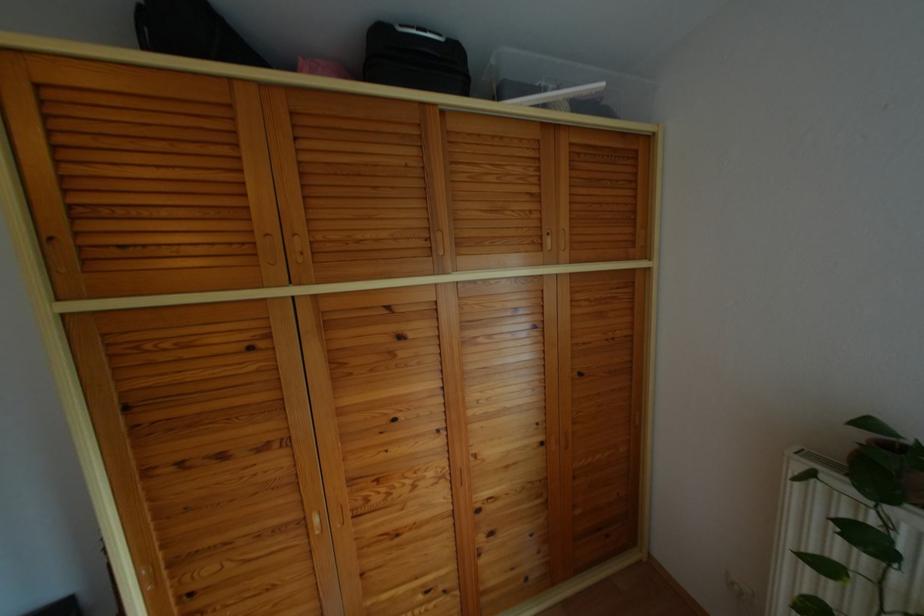
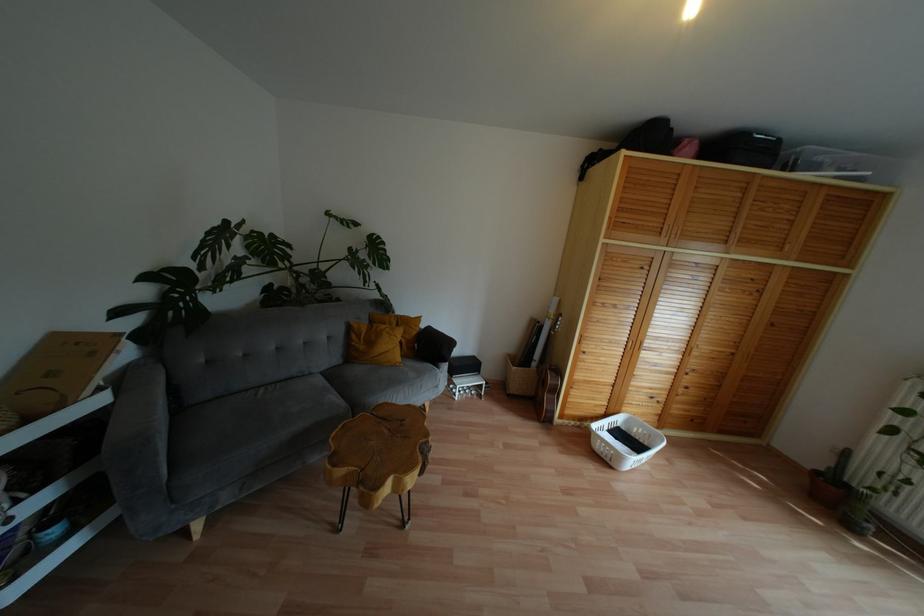
In a continuous first-person perspective shot, in which direction is the camera moving?

The cameraman walked toward left, backward.